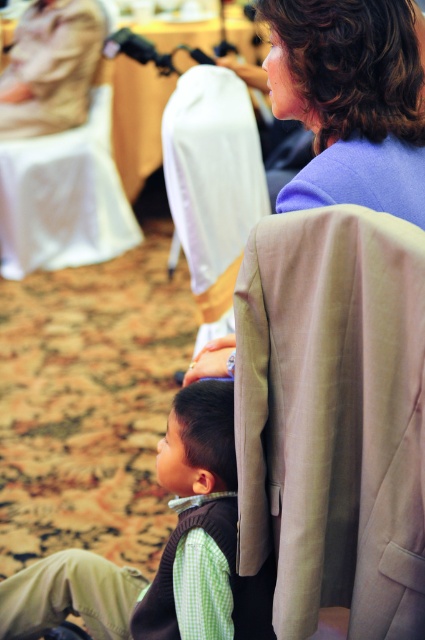
Question: Is green checkered shirt at lower left smaller than white fabric chair at upper left?

Choices:
 (A) yes
 (B) no

Answer: (A)

Question: Which of the following is the closest to the observer?

Choices:
 (A) (238, 403)
 (B) (184, 211)
 (C) (17, 152)
 (D) (306, 166)

Answer: (A)

Question: Among these points, which one is farthest from the camera?

Choices:
 (A) (195, 234)
 (B) (93, 170)
 (C) (189, 403)
 (D) (283, 195)

Answer: (B)

Question: Where is green checkered shirt at lower left located in relation to white fabric chair at upper left in the image?

Choices:
 (A) right
 (B) left

Answer: (A)

Question: Does tan fabric chair at center have a lesser width compared to light brown woolen blazer at center?

Choices:
 (A) yes
 (B) no

Answer: (A)

Question: Which point is farther from the camera taking this photo?

Choices:
 (A) (317, 204)
 (B) (74, 230)
 (C) (227, 451)

Answer: (B)